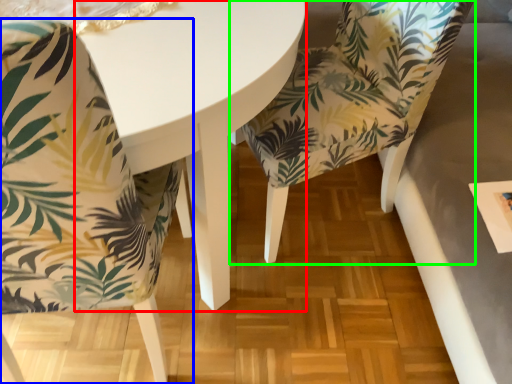
Question: Which object is the farthest from round table (highlighted by a red box)? Choose among these: chair (highlighted by a blue box) or chair (highlighted by a green box).

Choices:
 (A) chair
 (B) chair

Answer: (B)